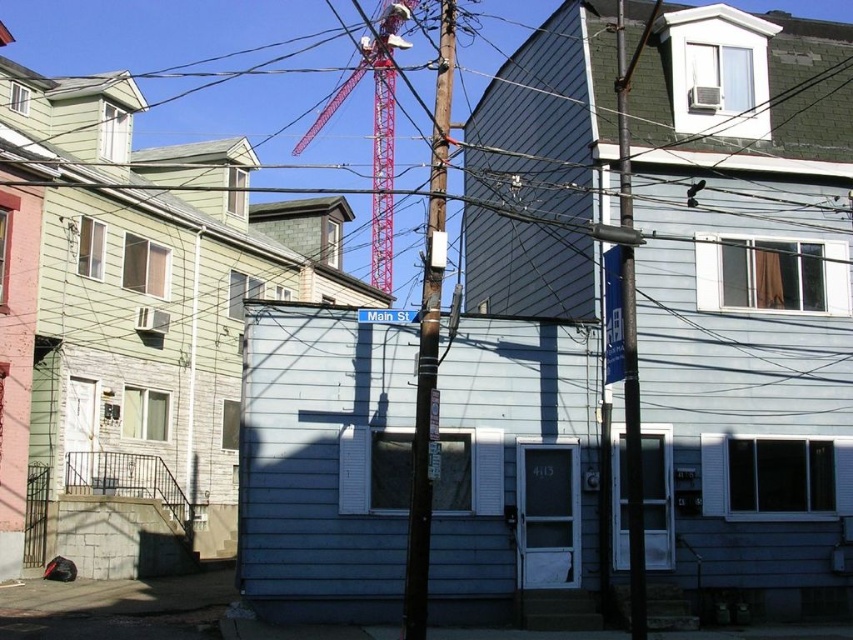
You are a delivery driver who needs to park your truck near the brown wooden telegraph pole at center and the red metal crane at upper center. Which object should you park closer to if you want to be as close as possible to both?

You should park closer to the brown wooden telegraph pole at center because it is positioned on the right side of the red metal crane at upper center, making it the closer point between the two.

You are a city planner assessing the space between the brown wooden telegraph pole at center and the red metal crane at upper center. Given that the pole is narrower than the crane, would placing a new streetlight between them require adjusting their positions to ensure enough clearance?

The brown wooden telegraph pole at center is narrower than the red metal crane at upper center. Since the pole is thinner, there might be sufficient space between them for a streetlight without needing adjustment, but exact clearance depends on the streetlight dimensions and local regulations.

You are standing at the bottom left corner of the image where the dark bag is located. Looking towards the center of the image, can you see the smooth wood telegraph pole at center?

Yes, the smooth wood telegraph pole at center is located at point (633, 451), which is in the center of the image. Since you are at the bottom left corner, looking towards the center would allow you to see the pole.